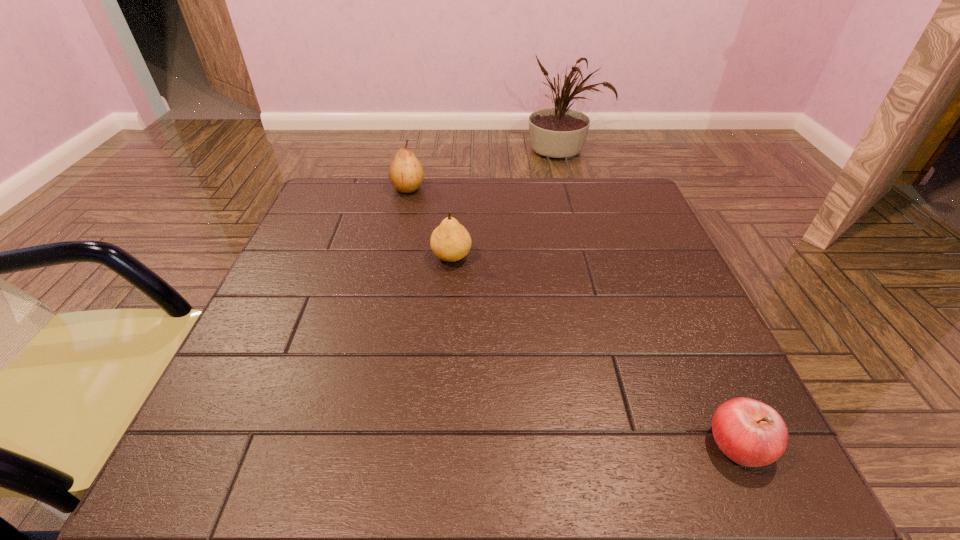
Identify the location of object that is at the near edge. The image size is (960, 540). (749, 432).

Identify the location of object at the right edge. (749, 432).

You are a GUI agent. You are given a task and a screenshot of the screen. Output one action in this format:
    pyautogui.click(x=<x>, y=<y>)
    Task: Click on the object present at the near right corner
    The width and height of the screenshot is (960, 540).
    Given the screenshot: What is the action you would take?
    pyautogui.click(x=749, y=432)

In the image, there is a desktop. Identify the location of vacant space at the far edge. This screenshot has width=960, height=540. (465, 183).

Image resolution: width=960 pixels, height=540 pixels. Identify the location of vacant space at the near edge of the desktop. (652, 441).

In the image, there is a desktop. Where is `vacant space at the left edge`? vacant space at the left edge is located at coordinates (245, 390).

This screenshot has height=540, width=960. In the image, there is a desktop. What are the coordinates of `free region at the right edge` in the screenshot? It's located at (726, 381).

You are a GUI agent. You are given a task and a screenshot of the screen. Output one action in this format:
    pyautogui.click(x=<x>, y=<y>)
    Task: Click on the blank space at the far left corner of the desktop
    This screenshot has width=960, height=540.
    Given the screenshot: What is the action you would take?
    pyautogui.click(x=330, y=225)

The height and width of the screenshot is (540, 960). In the image, there is a desktop. Find the location of `vacant area at the far right corner`. vacant area at the far right corner is located at coordinates coord(594,179).

Locate an element on the screen. The height and width of the screenshot is (540, 960). vacant space that is in between the shortest object and the second farthest object is located at coordinates (595, 350).